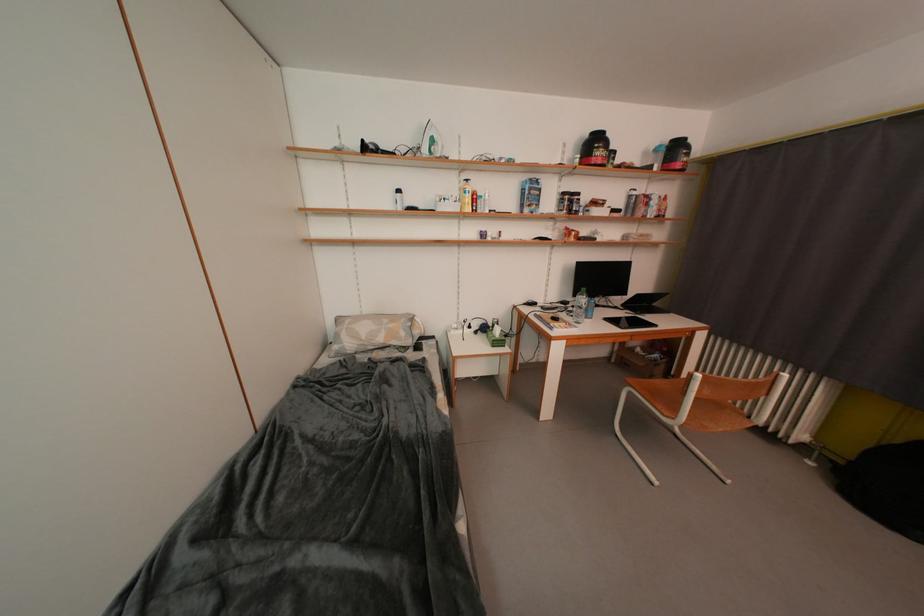
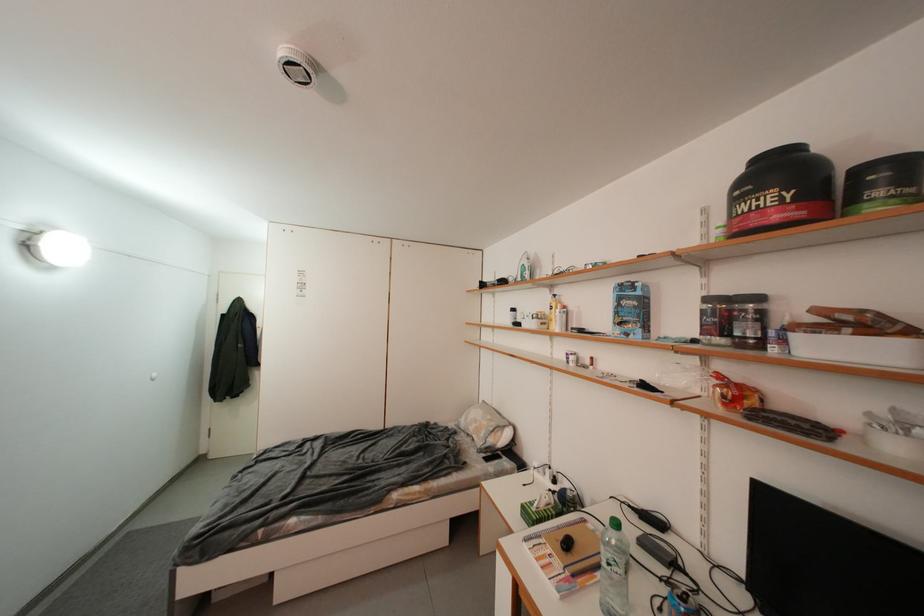
Where in the second image is the point corresponding to (538,192) from the first image?

(627, 302)